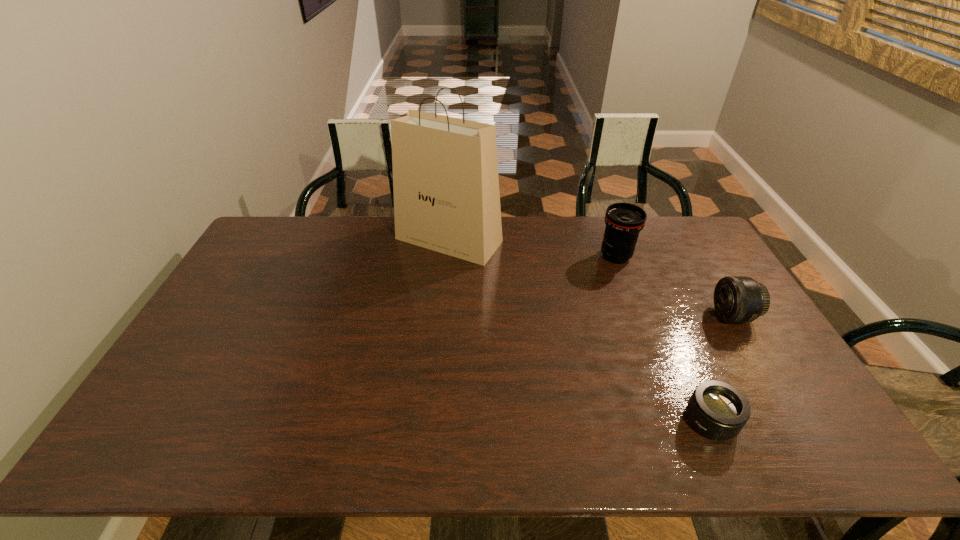
In order to click on vacant space located 0.400m on the front-facing side of the rightmost object in this screenshot , I will do `click(580, 316)`.

What are the coordinates of `free space located 0.250m on the front-facing side of the rightmost object` in the screenshot? It's located at (630, 316).

Where is `vacant position located on the front-facing side of the rightmost object`? vacant position located on the front-facing side of the rightmost object is located at coordinates (663, 316).

Locate an element on the screen. The width and height of the screenshot is (960, 540). vacant space located 0.240m on the side of the shortest object with brand markings and control switches is located at coordinates (584, 421).

This screenshot has width=960, height=540. I want to click on vacant space situated 0.360m on the side of the shortest object with brand markings and control switches, so click(534, 421).

You are a GUI agent. You are given a task and a screenshot of the screen. Output one action in this format:
    pyautogui.click(x=<x>, y=<y>)
    Task: Click on the vacant space located 0.240m on the side of the shortest object with brand markings and control switches
    This screenshot has width=960, height=540.
    Given the screenshot: What is the action you would take?
    pyautogui.click(x=584, y=421)

Locate an element on the screen. Image resolution: width=960 pixels, height=540 pixels. shopping bag that is positioned at the far edge is located at coordinates (446, 192).

Where is `telephoto lens located in the far edge section of the desktop`? The height and width of the screenshot is (540, 960). telephoto lens located in the far edge section of the desktop is located at coordinates (624, 221).

Locate an element on the screen. object present at the near edge is located at coordinates (718, 410).

You are a GUI agent. You are given a task and a screenshot of the screen. Output one action in this format:
    pyautogui.click(x=<x>, y=<y>)
    Task: Click on the object present at the right edge
    Image resolution: width=960 pixels, height=540 pixels.
    Given the screenshot: What is the action you would take?
    pyautogui.click(x=738, y=299)